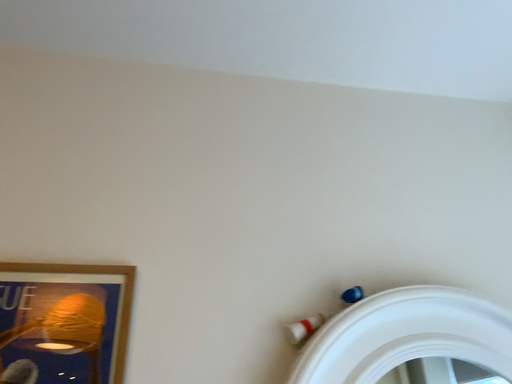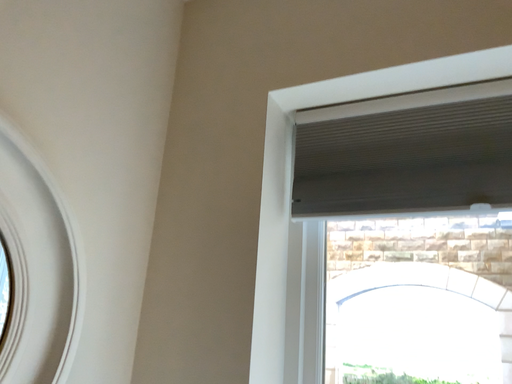
Question: Which way did the camera rotate in the video?

Choices:
 (A) rotated upward
 (B) rotated downward

Answer: (B)